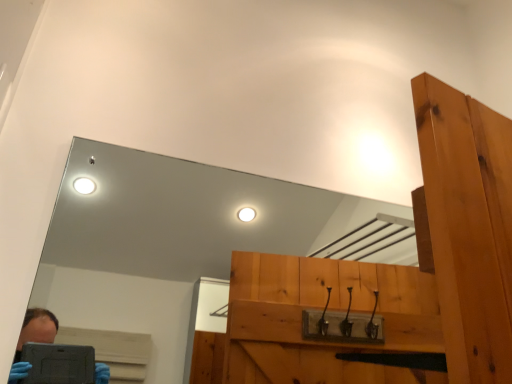
Image resolution: width=512 pixels, height=384 pixels. Identify the location of clear glass mirror at upper center. (169, 239).

What do you see at coordinates (169, 239) in the screenshot? I see `clear glass mirror at upper center` at bounding box center [169, 239].

The width and height of the screenshot is (512, 384). What are the coordinates of `clear glass mirror at upper center` in the screenshot? It's located at (169, 239).